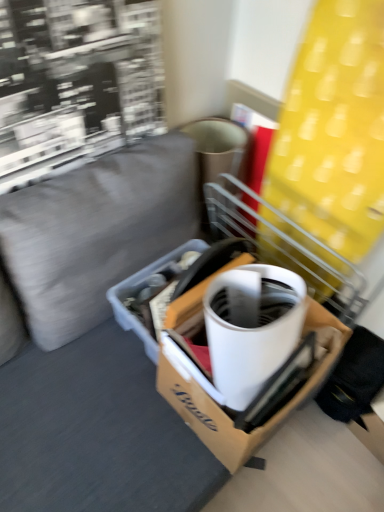
This screenshot has height=512, width=384. Describe the element at coordinates (247, 358) in the screenshot. I see `cardboard box at center` at that location.

I want to click on cardboard box at center, so click(247, 358).

In order to face cardboard box at center, should I rotate leftwards or rightwards?

Rotate your view right by about 6.648°.

Find the location of a particular element. The height and width of the screenshot is (512, 384). cardboard box at center is located at coordinates (247, 358).